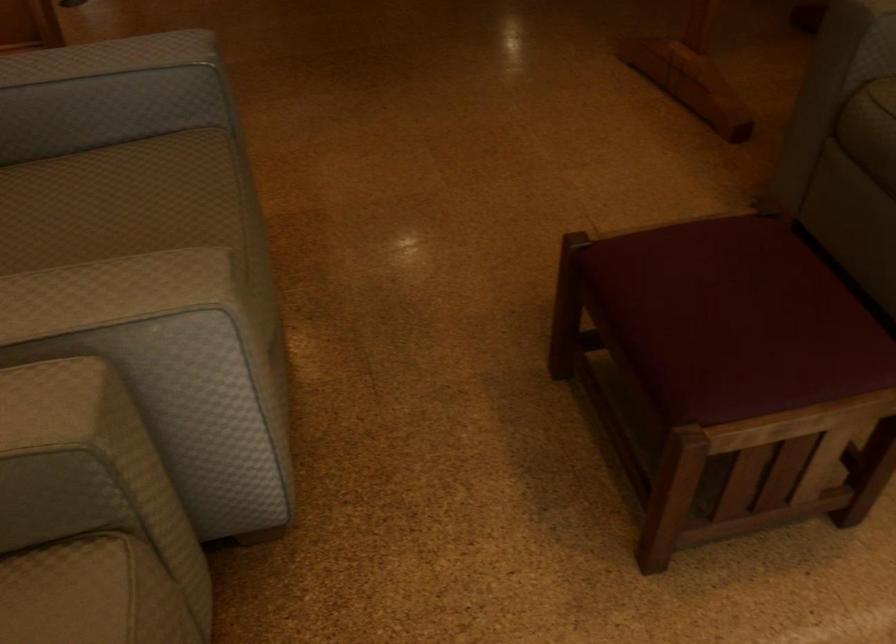
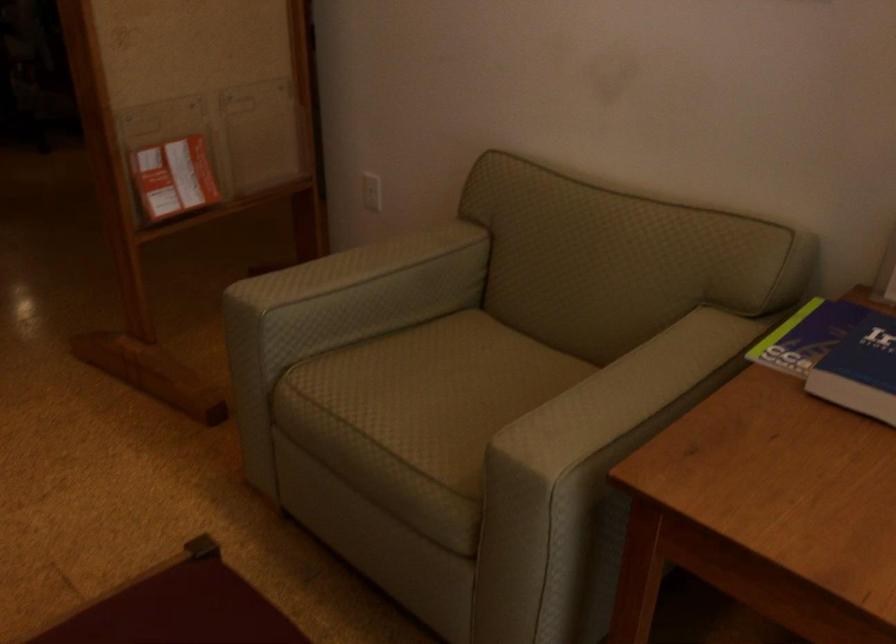
Question: The camera is either moving clockwise (left) or counter-clockwise (right) around the object. The first image is from the beginning of the video and the second image is from the end. Is the camera moving left or right when shooting the video?

Choices:
 (A) Left
 (B) Right

Answer: (A)